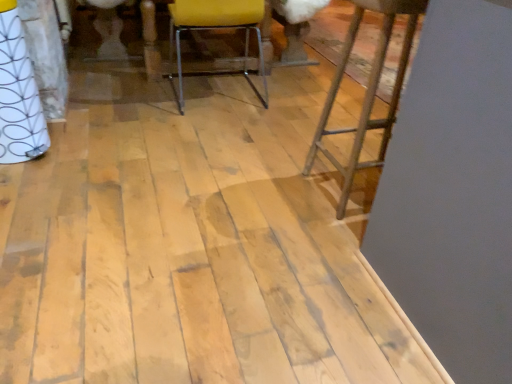
Question: Looking at the image, does yellow fabric chair at center seem bigger or smaller compared to rustic wood stool at right?

Choices:
 (A) big
 (B) small

Answer: (A)

Question: From the image's perspective, is yellow fabric chair at center above or below rustic wood stool at right?

Choices:
 (A) below
 (B) above

Answer: (B)

Question: Based on their positions, is yellow fabric chair at center located to the left or right of rustic wood stool at right?

Choices:
 (A) left
 (B) right

Answer: (A)

Question: From the image's perspective, relative to yellow fabric chair at center, is rustic wood stool at right above or below?

Choices:
 (A) below
 (B) above

Answer: (A)

Question: Is rustic wood stool at right taller or shorter than yellow fabric chair at center?

Choices:
 (A) tall
 (B) short

Answer: (A)

Question: Considering their positions, is rustic wood stool at right located in front of or behind yellow fabric chair at center?

Choices:
 (A) behind
 (B) front

Answer: (B)

Question: Would you say rustic wood stool at right is inside or outside yellow fabric chair at center?

Choices:
 (A) inside
 (B) outside

Answer: (B)